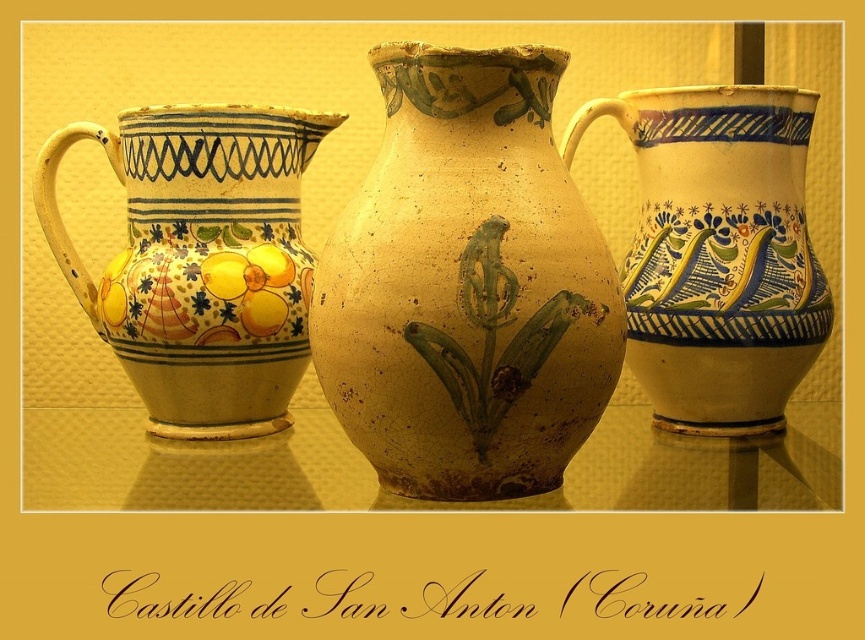
Which is more to the right, earthenware vase at center or matte yellow jug at center?

matte yellow jug at center is more to the right.

Between point (472, 285) and point (748, 420), which one is positioned behind?

Point (748, 420)

I want to click on earthenware vase at center, so click(466, 284).

Can you confirm if earthenware vase at center is shorter than matte ceramic jug at left?

In fact, earthenware vase at center may be taller than matte ceramic jug at left.

Can you confirm if earthenware vase at center is positioned to the right of matte ceramic jug at left?

Indeed, earthenware vase at center is positioned on the right side of matte ceramic jug at left.

The width and height of the screenshot is (865, 640). What are the coordinates of `earthenware vase at center` in the screenshot? It's located at (466, 284).

At what (x,y) coordinates should I click in order to perform the action: click on earthenware vase at center. Please return your answer as a coordinate pair (x, y). This screenshot has height=640, width=865. Looking at the image, I should click on (466, 284).

This screenshot has width=865, height=640. I want to click on matte ceramic jug at left, so click(200, 260).

Who is more forward, (158, 332) or (734, 177)?

Point (158, 332) is more forward.

The height and width of the screenshot is (640, 865). I want to click on matte ceramic jug at left, so click(200, 260).